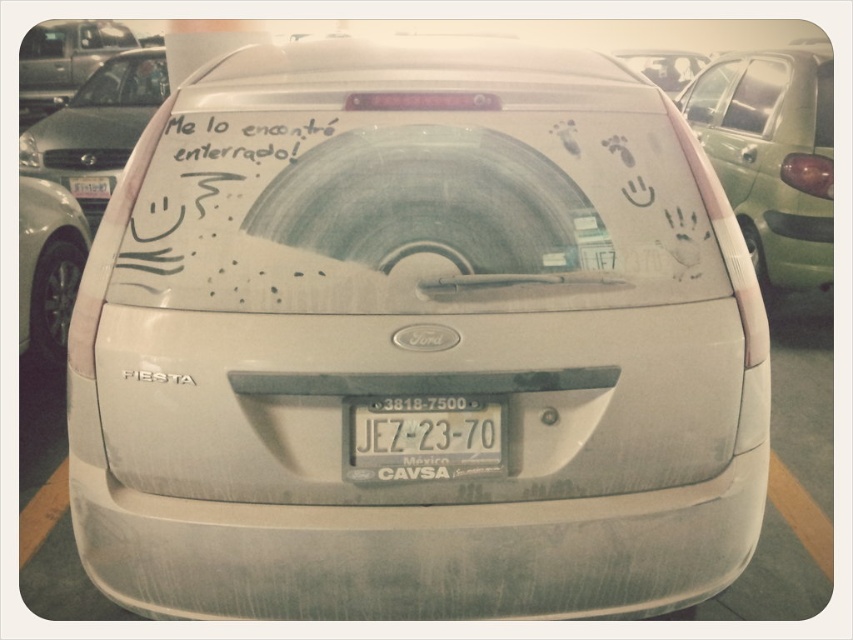
From the picture: Does white plastic license plate at center have a greater width compared to white matte car at upper center?

In fact, white plastic license plate at center might be narrower than white matte car at upper center.

Is white plastic license plate at center taller than white matte car at upper center?

Incorrect, white plastic license plate at center's height is not larger of white matte car at upper center's.

Measure the distance between point [466,460] and camera.

Point [466,460] is 5.06 feet from camera.

The image size is (853, 640). What are the coordinates of `white plastic license plate at center` in the screenshot? It's located at (422, 438).

Is white plastic license plate at center thinner than matte silver truck at upper left?

Yes.

Image resolution: width=853 pixels, height=640 pixels. Describe the element at coordinates (422, 438) in the screenshot. I see `white plastic license plate at center` at that location.

Image resolution: width=853 pixels, height=640 pixels. Describe the element at coordinates (422, 438) in the screenshot. I see `white plastic license plate at center` at that location.

Identify the location of white plastic license plate at center. Image resolution: width=853 pixels, height=640 pixels. (422, 438).

In order to click on green matte surfboard at right in this screenshot , I will do `click(772, 156)`.

Does green matte surfboard at right appear on the left side of silver metallic car at left?

No, green matte surfboard at right is not to the left of silver metallic car at left.

Find the location of a particular element. The width and height of the screenshot is (853, 640). green matte surfboard at right is located at coordinates (772, 156).